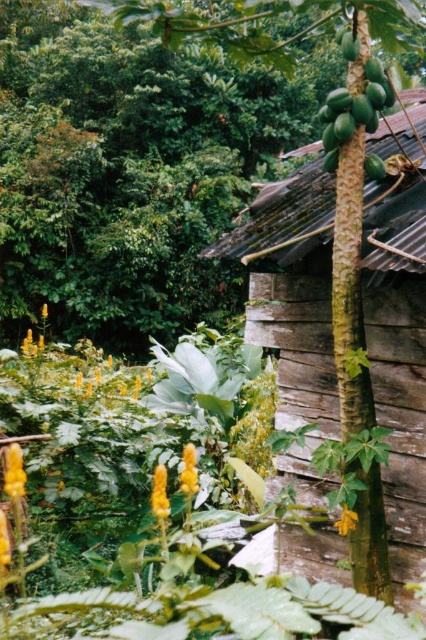
Question: Among these objects, which one is nearest to the camera?

Choices:
 (A) wooden hut at right
 (B) green papaya at center

Answer: (B)

Question: Which object is farther from the camera taking this photo?

Choices:
 (A) wooden hut at right
 (B) green matte banana tree at center

Answer: (A)

Question: Is wooden hut at right bigger than green papaya at center?

Choices:
 (A) yes
 (B) no

Answer: (B)

Question: Considering the real-world distances, which object is farthest from the green papaya at center?

Choices:
 (A) wooden hut at right
 (B) green matte banana tree at center

Answer: (A)

Question: In this image, where is green matte banana tree at center located relative to green papaya at center?

Choices:
 (A) above
 (B) below

Answer: (B)

Question: Can you confirm if wooden hut at right is positioned to the right of green matte banana tree at center?

Choices:
 (A) no
 (B) yes

Answer: (A)